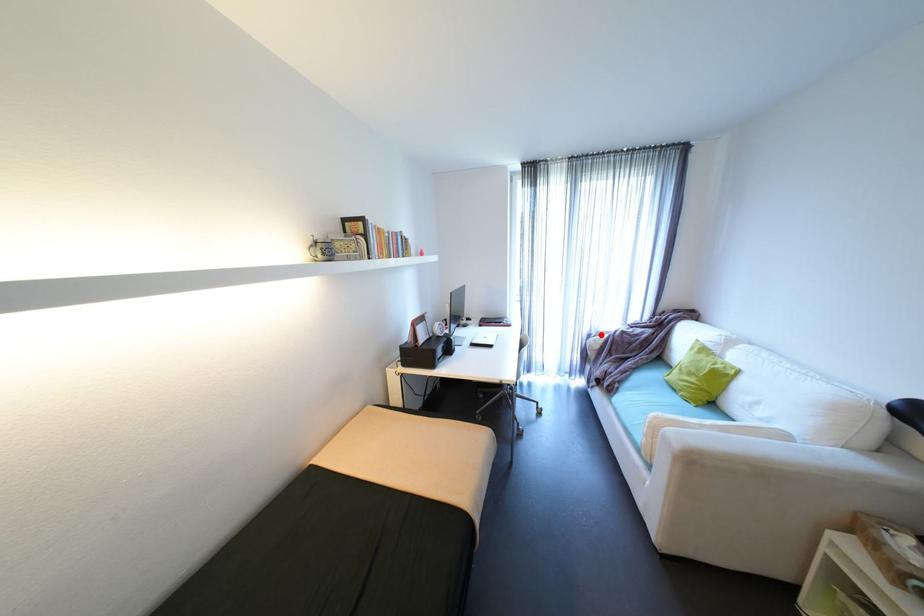
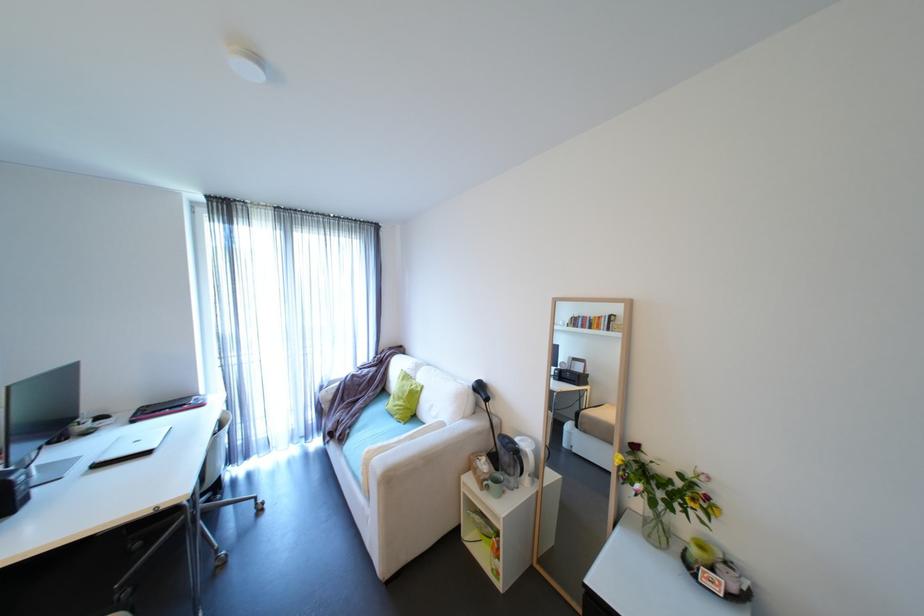
In the second image, find the point that corresponds to the highlighted location in the first image.

(333, 386)